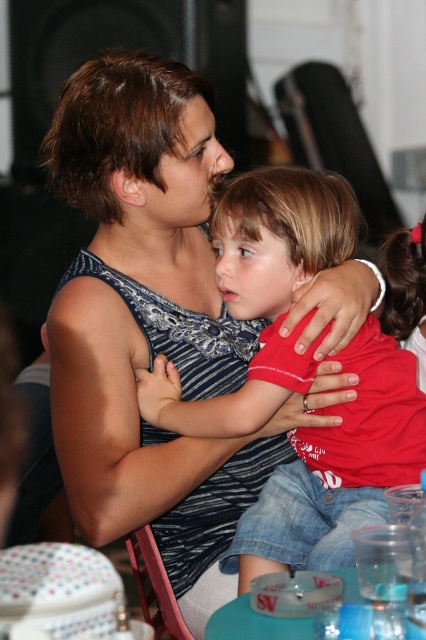
You are a photographer at a social event. You need to capture a closeup of the red matte shirt at center without including the wooden chair at lower center in the frame. Is this possible based on their positions?

The red matte shirt at center is positioned over the wooden chair at lower center, so it is likely that the shirt is covering the chair. Therefore, you can take a closeup of the red matte shirt at center without the wooden chair at lower center appearing in the frame as long as the focus remains on the shirt area.

You are a photographer at the event and need to position a small microphone stand between the smooth red hair at center and the wooden chair at lower center. Considering their sizes, will the space between them accommodate the stand?

The smooth red hair at center is thinner than the wooden chair at lower center, so there should be enough space between them to place the microphone stand.